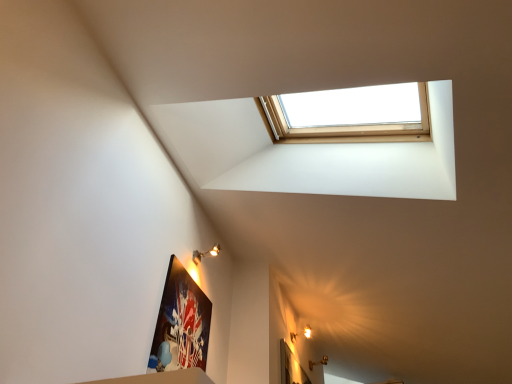
Question: Looking at their shapes, would you say matte black picture frame at lower left is wider or thinner than matte gold light fixture at upper center, which is the 1th light fixture in front-to-back order?

Choices:
 (A) thin
 (B) wide

Answer: (A)

Question: Based on their positions, is matte black picture frame at lower left located to the left or right of matte gold light fixture at upper center, positioned as the second light fixture in bottom-to-top order?

Choices:
 (A) left
 (B) right

Answer: (A)

Question: Estimate the real-world distances between objects in this image. Which object is closer to the matte black picture frame at lower left?

Choices:
 (A) matte gold light fixture at upper center, which ranks as the 2th light fixture in back-to-front order
 (B) matte gold wall sconce at upper right, which is counted as the 2th light fixture, starting from the top

Answer: (A)

Question: Which is nearer to the matte gold light fixture at upper center, which is the 1th light fixture in front-to-back order?

Choices:
 (A) matte gold wall sconce at upper right, positioned as the first light fixture in bottom-to-top order
 (B) matte black picture frame at lower left

Answer: (B)